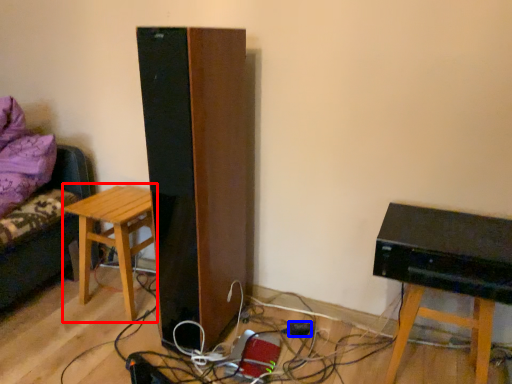
Question: Which of the following is the closest to the observer, stool (highlighted by a red box) or plug (highlighted by a blue box)?

Choices:
 (A) stool
 (B) plug

Answer: (A)